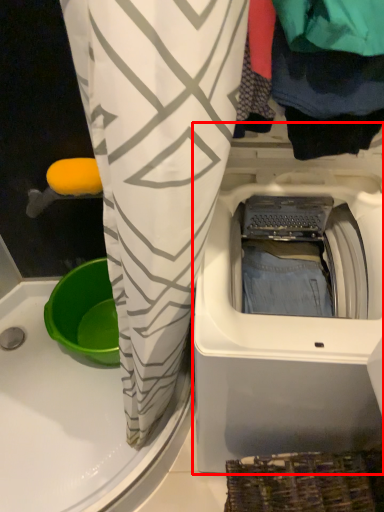
Question: From the image's perspective, considering the relative positions of washing machine (annotated by the red box) and clothing in the image provided, where is washing machine (annotated by the red box) located with respect to the staircase?

Choices:
 (A) below
 (B) above

Answer: (A)